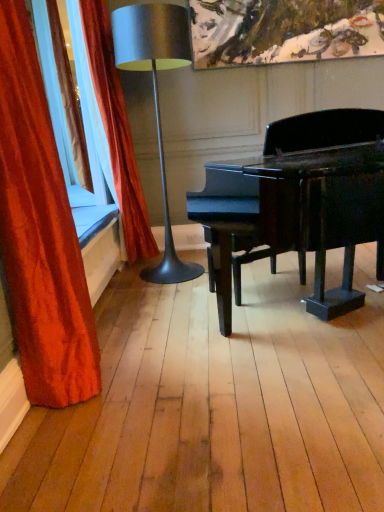
Question: Is metallic silver lamp at left positioned with its back to velvet red curtain at left, acting as the first curtain starting from the front?

Choices:
 (A) no
 (B) yes

Answer: (A)

Question: Can you confirm if metallic silver lamp at left is shorter than velvet red curtain at left, acting as the first curtain starting from the front?

Choices:
 (A) yes
 (B) no

Answer: (B)

Question: Is metallic silver lamp at left in contact with velvet red curtain at left, acting as the first curtain starting from the front?

Choices:
 (A) yes
 (B) no

Answer: (B)

Question: Considering the relative sizes of metallic silver lamp at left and velvet red curtain at left, the second curtain viewed from the back, in the image provided, is metallic silver lamp at left thinner than velvet red curtain at left, the second curtain viewed from the back,?

Choices:
 (A) no
 (B) yes

Answer: (A)

Question: From a real-world perspective, does metallic silver lamp at left sit lower than velvet red curtain at left, the second curtain viewed from the back?

Choices:
 (A) yes
 (B) no

Answer: (B)

Question: From a real-world perspective, is velvet red curtain at left, the second curtain viewed from the back, positioned above or below velvet red curtain at left, the 1th curtain from the back?

Choices:
 (A) below
 (B) above

Answer: (A)

Question: Which is correct: velvet red curtain at left, acting as the first curtain starting from the front, is inside velvet red curtain at left, the 1th curtain from the back, or outside of it?

Choices:
 (A) inside
 (B) outside

Answer: (B)

Question: Considering the positions of velvet red curtain at left, acting as the first curtain starting from the front, and velvet red curtain at left, acting as the second curtain starting from the front, in the image, is velvet red curtain at left, acting as the first curtain starting from the front, taller or shorter than velvet red curtain at left, acting as the second curtain starting from the front,?

Choices:
 (A) tall
 (B) short

Answer: (B)

Question: Is velvet red curtain at left, the second curtain viewed from the back, in front of or behind velvet red curtain at left, acting as the second curtain starting from the front, in the image?

Choices:
 (A) behind
 (B) front

Answer: (B)

Question: Looking at their shapes, would you say velvet red curtain at left, the second curtain viewed from the back, is wider or thinner than metallic silver lamp at left?

Choices:
 (A) wide
 (B) thin

Answer: (B)

Question: Is velvet red curtain at left, acting as the first curtain starting from the front, bigger or smaller than metallic silver lamp at left?

Choices:
 (A) big
 (B) small

Answer: (B)

Question: Is velvet red curtain at left, acting as the first curtain starting from the front, situated inside metallic silver lamp at left or outside?

Choices:
 (A) inside
 (B) outside

Answer: (B)

Question: From a real-world perspective, is velvet red curtain at left, acting as the first curtain starting from the front, physically located above or below metallic silver lamp at left?

Choices:
 (A) below
 (B) above

Answer: (A)

Question: Is metallic silver lamp at left inside the boundaries of velvet red curtain at left, acting as the second curtain starting from the front, or outside?

Choices:
 (A) inside
 (B) outside

Answer: (B)

Question: Is metallic silver lamp at left in front of or behind velvet red curtain at left, the 1th curtain from the back, in the image?

Choices:
 (A) behind
 (B) front

Answer: (B)